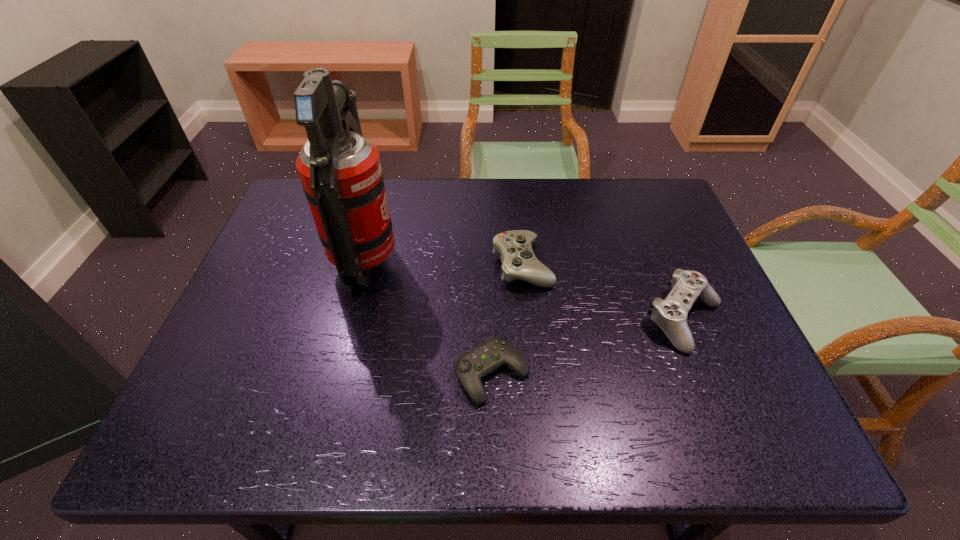
Identify which control is the second closest to the rightmost control. Please provide its 2D coordinates. Your answer should be formatted as a tuple, i.e. [(x, y)], where the tuple contains the x and y coordinates of a point satisfying the conditions above.

[(470, 367)]

Identify the location of the closest control to the tallest object. The image size is (960, 540). tap(470, 367).

Where is `vacant space that satisfies the following two spatial constraints: 1. on the back side of the rightmost object; 2. on the front label side of the tallest object`? Image resolution: width=960 pixels, height=540 pixels. vacant space that satisfies the following two spatial constraints: 1. on the back side of the rightmost object; 2. on the front label side of the tallest object is located at coordinates (660, 260).

Identify the location of free space that satisfies the following two spatial constraints: 1. on the front label side of the rightmost object; 2. on the right side of the fire extinguisher. (351, 319).

The height and width of the screenshot is (540, 960). In order to click on free space that satisfies the following two spatial constraints: 1. on the front label side of the leftmost object; 2. on the back side of the rightmost control in this screenshot , I will do `click(351, 319)`.

Image resolution: width=960 pixels, height=540 pixels. Identify the location of free space that satisfies the following two spatial constraints: 1. on the front label side of the shortest control; 2. on the left side of the leftmost object. (338, 374).

Locate an element on the screen. Image resolution: width=960 pixels, height=540 pixels. free space that satisfies the following two spatial constraints: 1. on the front label side of the leftmost object; 2. on the right side of the shortest object is located at coordinates (338, 374).

This screenshot has height=540, width=960. In order to click on free location that satisfies the following two spatial constraints: 1. on the front label side of the leftmost object; 2. on the left side of the shortest control in this screenshot , I will do `click(338, 374)`.

Where is `free space that satisfies the following two spatial constraints: 1. on the back side of the rightmost object; 2. on the front label side of the tallest object`? The height and width of the screenshot is (540, 960). free space that satisfies the following two spatial constraints: 1. on the back side of the rightmost object; 2. on the front label side of the tallest object is located at coordinates (660, 260).